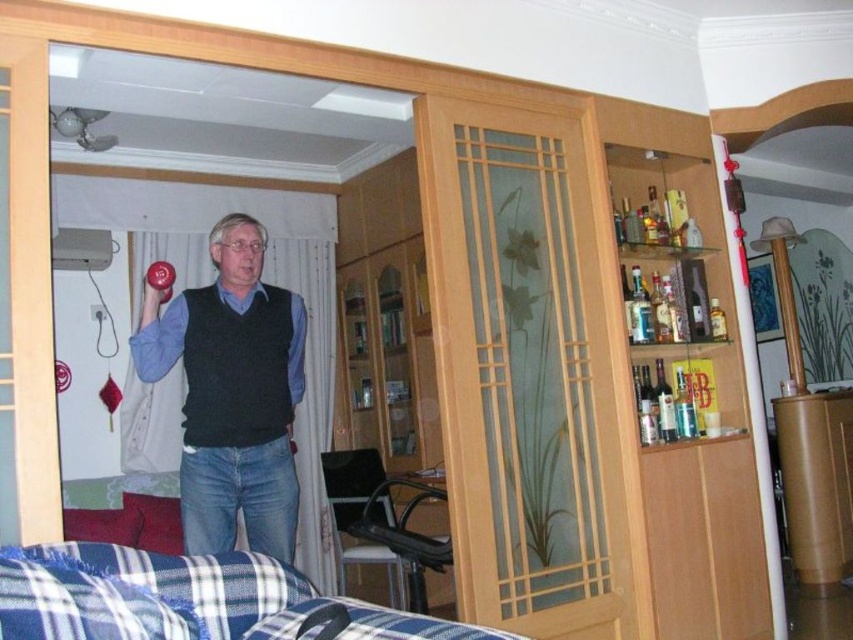
Question: Does transparent glass door at center have a lesser width compared to matte black vest at center?

Choices:
 (A) no
 (B) yes

Answer: (A)

Question: Among these objects, which one is nearest to the camera?

Choices:
 (A) transparent glass door at center
 (B) matte black vest at center

Answer: (B)

Question: Which object is closer to the camera taking this photo?

Choices:
 (A) blue plaid fabric at lower left
 (B) matte black vest at center

Answer: (A)

Question: Can you confirm if transparent glass door at center is wider than matte black vest at center?

Choices:
 (A) yes
 (B) no

Answer: (A)

Question: Can you confirm if transparent glass door at center is bigger than matte black vest at center?

Choices:
 (A) yes
 (B) no

Answer: (A)

Question: Estimate the real-world distances between objects in this image. Which object is closer to the transparent glass door at center?

Choices:
 (A) matte black vest at center
 (B) blue plaid fabric at lower left

Answer: (A)